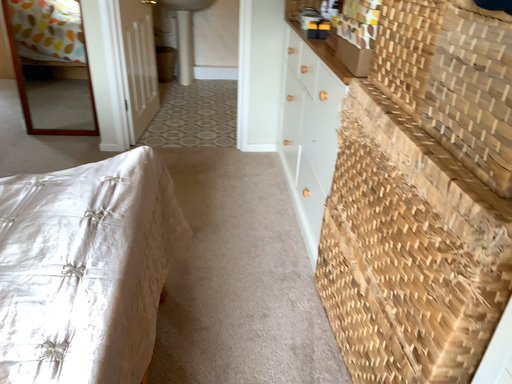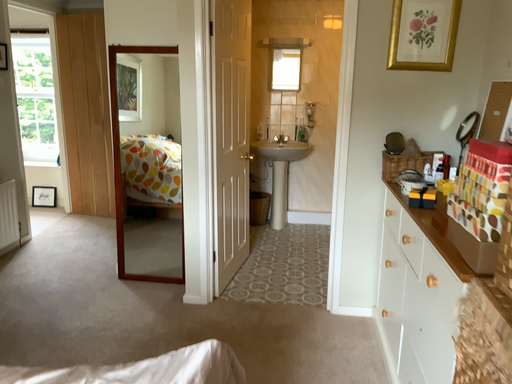
Question: How did the camera likely rotate when shooting the video?

Choices:
 (A) rotated downward
 (B) rotated upward

Answer: (B)